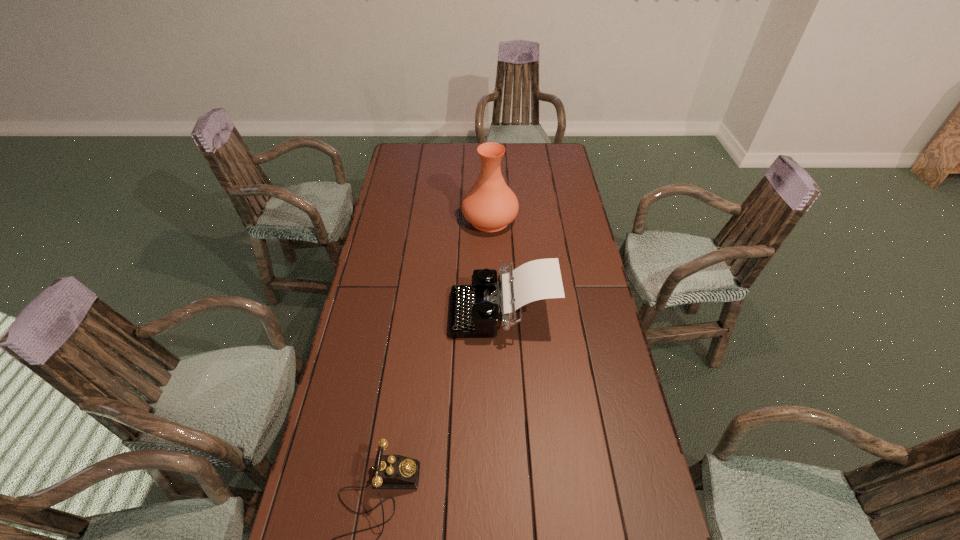
Where is `vacant space at the far right corner of the desktop`? This screenshot has height=540, width=960. vacant space at the far right corner of the desktop is located at coordinates (557, 165).

Locate an element on the screen. The image size is (960, 540). free point between the second farthest object and the tallest object is located at coordinates (496, 266).

Locate an element on the screen. This screenshot has height=540, width=960. blank region between the vase and the second tallest object is located at coordinates (496, 266).

Find the location of `free space between the second nearest object and the vase`. free space between the second nearest object and the vase is located at coordinates (496, 266).

Locate an element on the screen. The height and width of the screenshot is (540, 960). free space between the farthest object and the typewriter is located at coordinates (496, 266).

Image resolution: width=960 pixels, height=540 pixels. What are the coordinates of `object that is the nearest to the vase` in the screenshot? It's located at (475, 309).

I want to click on object that stands as the closest to the farthest object, so click(475, 309).